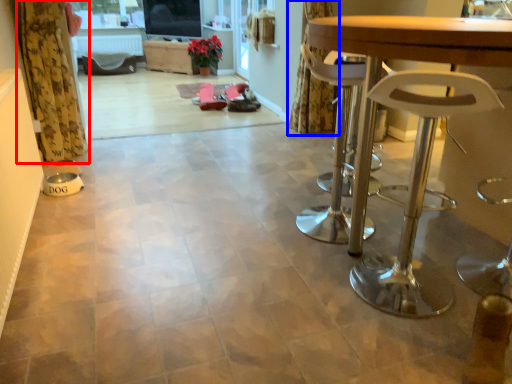
Question: Which point is further to the camera, curtain (highlighted by a red box) or curtain (highlighted by a blue box)?

Choices:
 (A) curtain
 (B) curtain

Answer: (B)